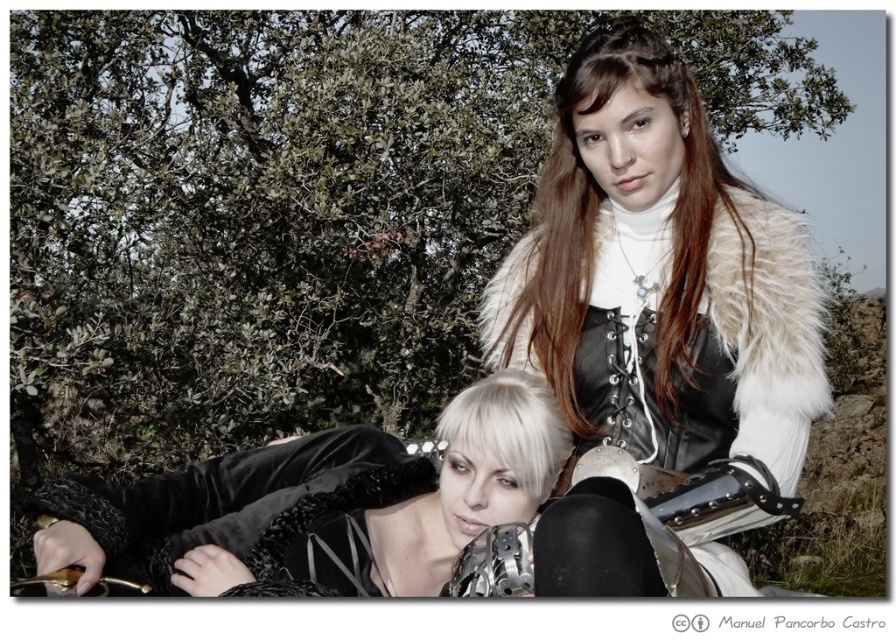
Question: Which point appears closest to the camera in this image?

Choices:
 (A) (294, 550)
 (B) (678, 563)

Answer: (B)

Question: Can you confirm if fur-lined leather vest at upper right is wider than velvet black dress at lower left?

Choices:
 (A) no
 (B) yes

Answer: (A)

Question: Is fur-lined leather vest at upper right wider than velvet black dress at lower left?

Choices:
 (A) yes
 (B) no

Answer: (B)

Question: Does fur-lined leather vest at upper right appear over velvet black dress at lower left?

Choices:
 (A) yes
 (B) no

Answer: (A)